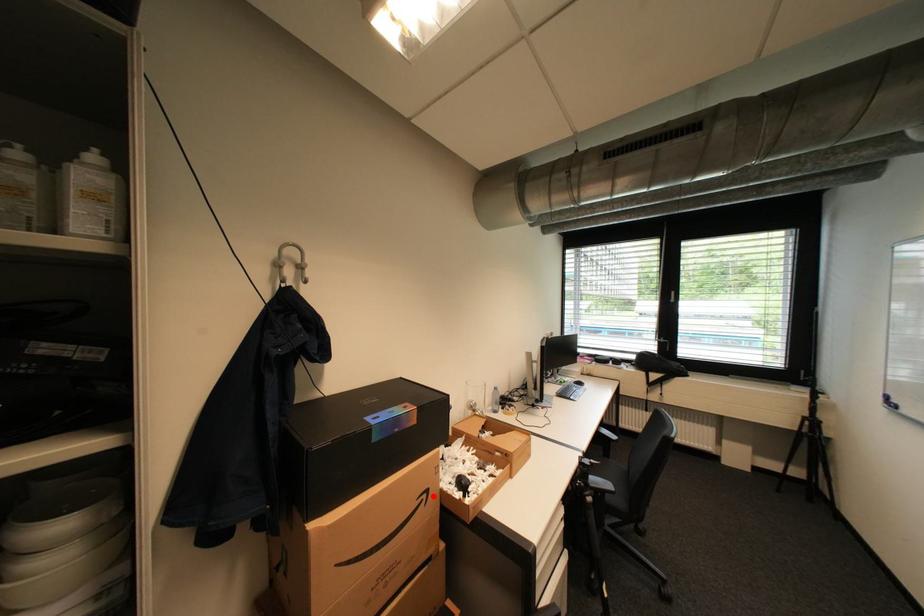
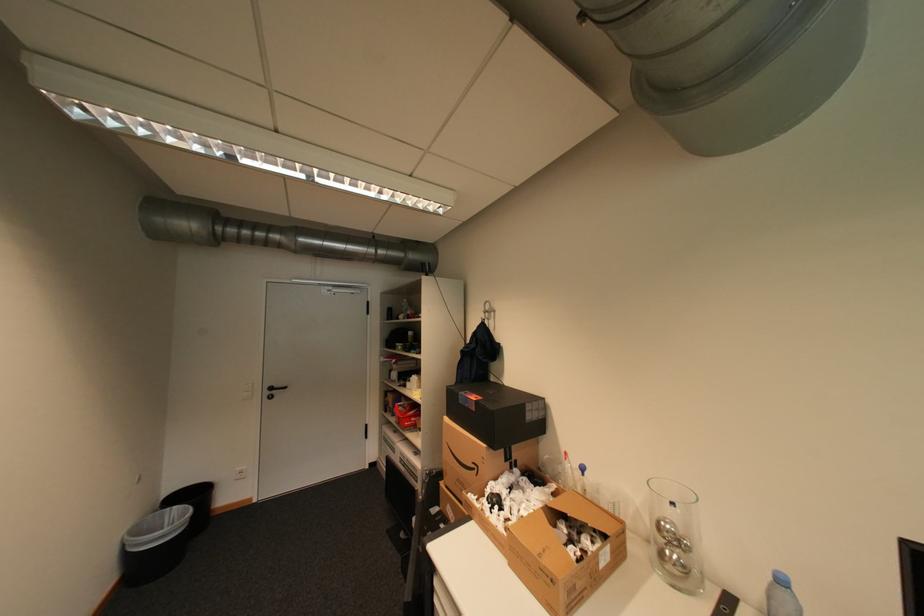
Question: I am providing you with two images of the same scene from different viewpoints. A red point is shown in image1. For the corresponding object point in image2, is it positioned nearer or farther from the camera?

Choices:
 (A) Nearer
 (B) Farther

Answer: (B)